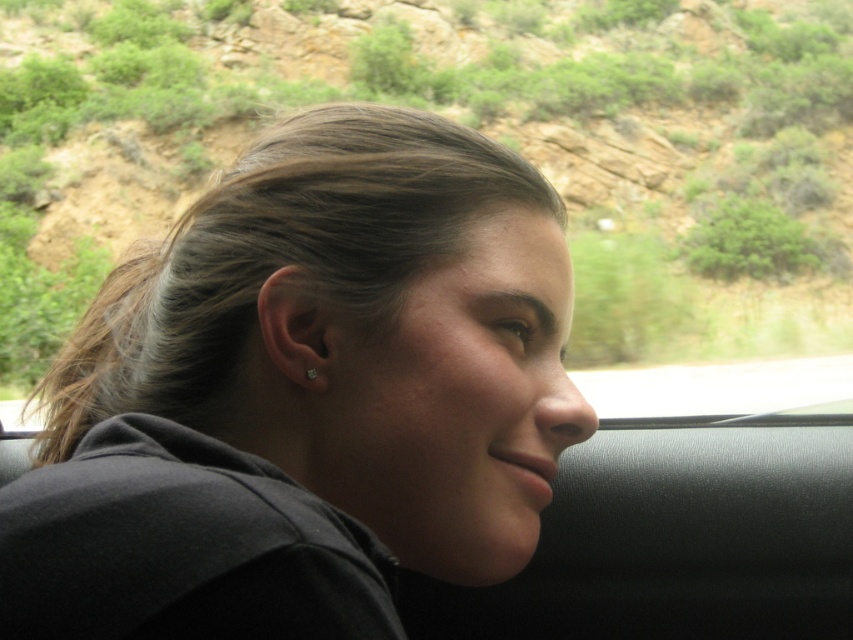
Can you confirm if matte black hair at center is smaller than clear crystal earring at ear?

No, matte black hair at center is not smaller than clear crystal earring at ear.

Between matte black hair at center and clear crystal earring at ear, which one has more height?

Standing taller between the two is matte black hair at center.

Which is in front, point (373, 388) or point (308, 368)?

Point (373, 388) is in front.

You are a GUI agent. You are given a task and a screenshot of the screen. Output one action in this format:
    pyautogui.click(x=<x>, y=<y>)
    Task: Click on the matte black hair at center
    This screenshot has height=640, width=853.
    Given the screenshot: What is the action you would take?
    pyautogui.click(x=305, y=396)

Based on the photo, does green grassy hillside at upper center appear over clear crystal earring at ear?

Correct, green grassy hillside at upper center is located above clear crystal earring at ear.

Does green grassy hillside at upper center appear on the left side of clear crystal earring at ear?

Yes, green grassy hillside at upper center is to the left of clear crystal earring at ear.

What do you see at coordinates (473, 116) in the screenshot? I see `green grassy hillside at upper center` at bounding box center [473, 116].

Locate an element on the screen. green grassy hillside at upper center is located at coordinates (473, 116).

Who is higher up, matte black hair at center or green grassy hillside at upper center?

Positioned higher is green grassy hillside at upper center.

Is point (194, 300) positioned behind point (96, 218)?

No, it is not.

The image size is (853, 640). Describe the element at coordinates (305, 396) in the screenshot. I see `matte black hair at center` at that location.

Locate an element on the screen. Image resolution: width=853 pixels, height=640 pixels. matte black hair at center is located at coordinates (305, 396).